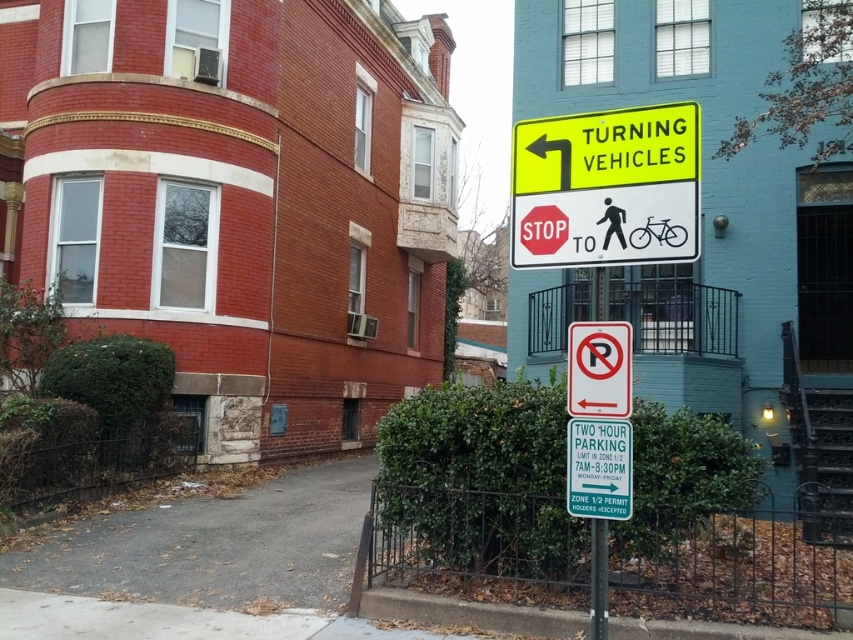
Based on the photo, you are standing on the street corner and want to read the green plastic sign at center. Is the metallic pole at lower center blocking your view of the sign?

The green plastic sign at center is in front of the metallic pole at lower center, so the pole is not blocking your view of the sign.

You are a pedestrian standing on the street corner and see the yellow reflective plastic sign at upper center and the green plastic sign at center. Which sign is located to the right when facing the buildings?

The yellow reflective plastic sign at upper center is positioned to the right of the green plastic sign at center.

You are a delivery driver approaching the intersection and need to read both the yellow reflective plastic sign at upper center and the green plastic sign at center. Which sign will be easier to notice from a distance?

The yellow reflective plastic sign at upper center is bigger than the green plastic sign at center, so it will be easier to notice from a distance.